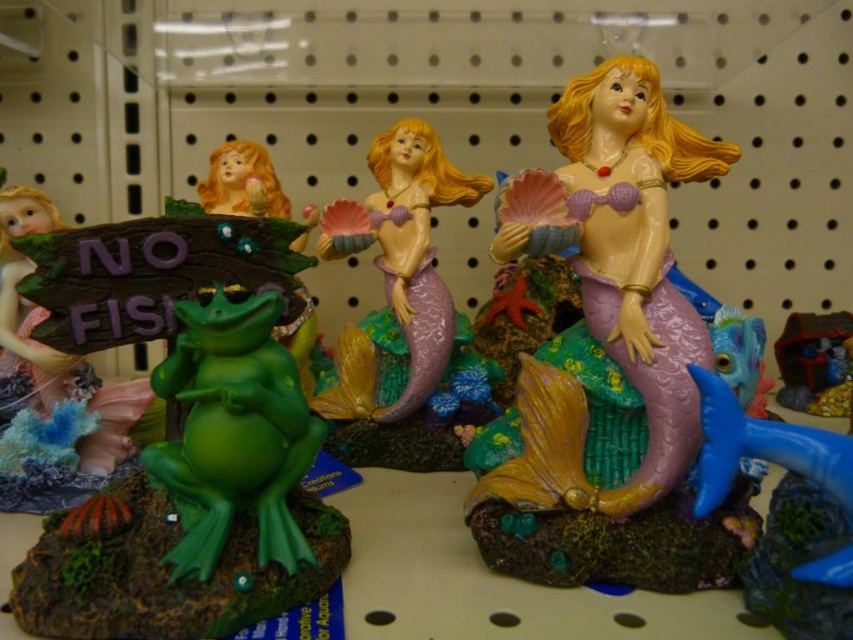
Question: Considering the relative positions of matte pink mermaid at center and metallic gold treasure chest at upper center in the image provided, where is matte pink mermaid at center located with respect to metallic gold treasure chest at upper center?

Choices:
 (A) above
 (B) below

Answer: (A)

Question: Is purple matte mermaid at center positioned behind matte green frog at left?

Choices:
 (A) yes
 (B) no

Answer: (A)

Question: Which is farther from the matte pink mermaid at center?

Choices:
 (A) metallic gold treasure chest at upper center
 (B) purple matte mermaid at center

Answer: (A)

Question: Which point is closer to the camera?

Choices:
 (A) (192, 467)
 (B) (384, 230)
 (C) (570, 112)
 (D) (836, 387)

Answer: (A)

Question: Estimate the real-world distances between objects in this image. Which object is farther from the metallic gold treasure chest at upper center?

Choices:
 (A) purple matte mermaid at center
 (B) matte green frog at left

Answer: (B)

Question: Can you confirm if matte green frog at left is thinner than metallic gold treasure chest at upper center?

Choices:
 (A) yes
 (B) no

Answer: (B)